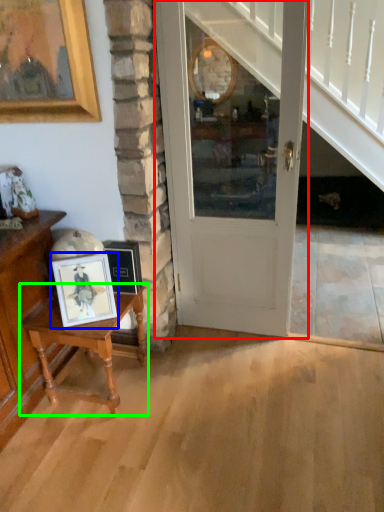
Question: Based on their relative distances, which object is nearer to door (highlighted by a red box)? Choose from picture frame (highlighted by a blue box) and table (highlighted by a green box).

Choices:
 (A) picture frame
 (B) table

Answer: (B)